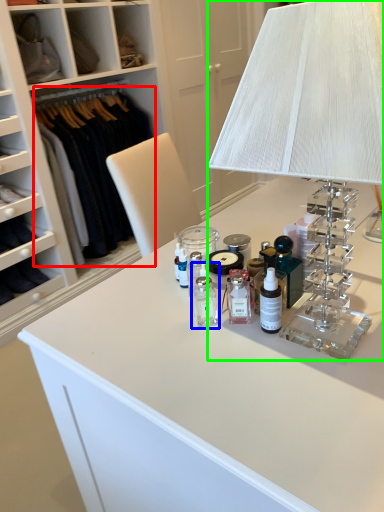
Question: Which is nearer to the clothing (highlighted by a red box)? toiletry (highlighted by a blue box) or table lamp (highlighted by a green box).

Choices:
 (A) toiletry
 (B) table lamp

Answer: (A)